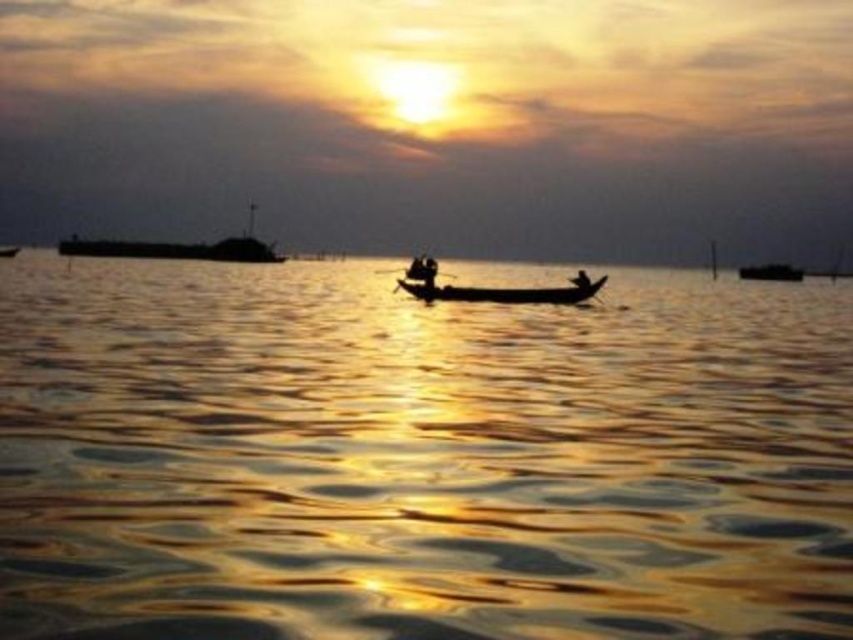
Question: Is smooth wood canoe at center smaller than black wood paddle at center?

Choices:
 (A) yes
 (B) no

Answer: (A)

Question: Can you confirm if dark matte boat at center is thinner than black wood paddle at center?

Choices:
 (A) yes
 (B) no

Answer: (B)

Question: Which is farther from the dark matte boat at center?

Choices:
 (A) smooth skin person at center
 (B) black wood paddle at center
 (C) glistening golden water at center
 (D) smooth wood canoe at center

Answer: (D)

Question: Which point is farther to the camera?

Choices:
 (A) dark gray metallic boat at left
 (B) black wood paddle at center

Answer: (A)

Question: Can you confirm if smooth wood canoe at center is thinner than smooth skin person at center?

Choices:
 (A) yes
 (B) no

Answer: (A)

Question: Considering the real-world distances, which object is farthest from the glistening golden water at center?

Choices:
 (A) smooth wood canoe at center
 (B) black wood paddle at center

Answer: (B)